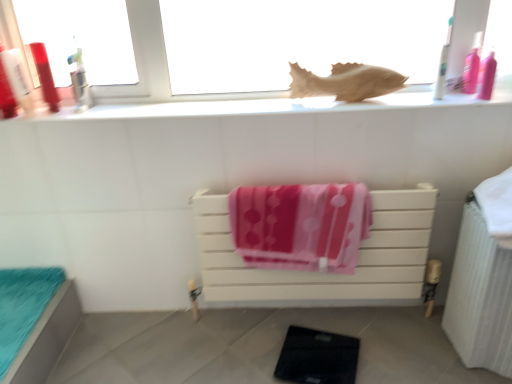
Where is `vacant area situated to the left side of pink plastic bottle at upper right, the first toiletry from the right`? This screenshot has width=512, height=384. vacant area situated to the left side of pink plastic bottle at upper right, the first toiletry from the right is located at coordinates click(431, 91).